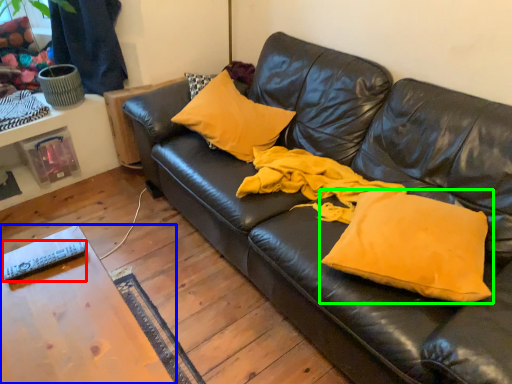
Question: Which object is the farthest from remote (highlighted by a red box)? Choose among these: table (highlighted by a blue box) or pillow (highlighted by a green box).

Choices:
 (A) table
 (B) pillow

Answer: (B)